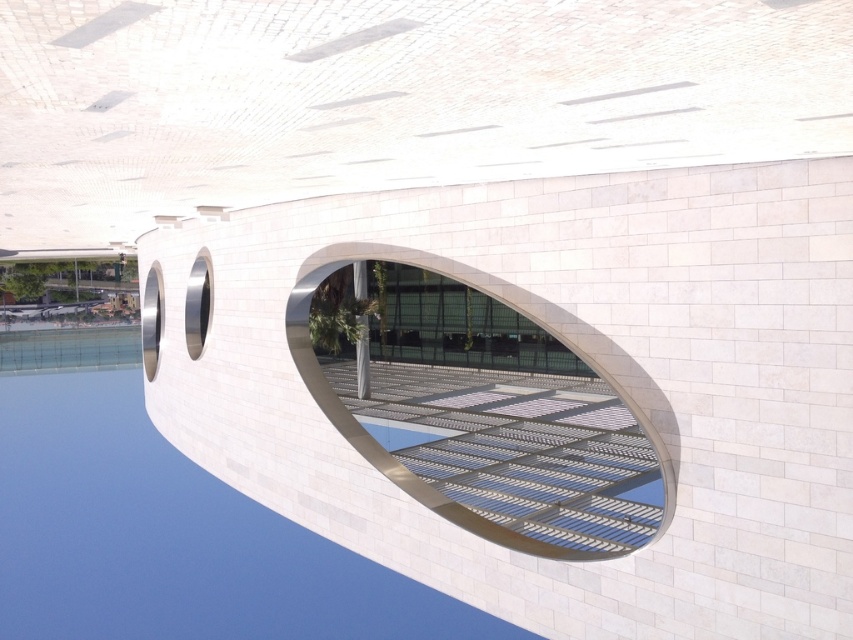
Who is more forward, (219, 579) or (560, 550)?

Point (560, 550) is in front.

Is point (102, 364) positioned in front of point (483, 458)?

No, (102, 364) is behind (483, 458).

Find the location of a particular element. The image size is (853, 640). transparent glass water at center is located at coordinates (163, 525).